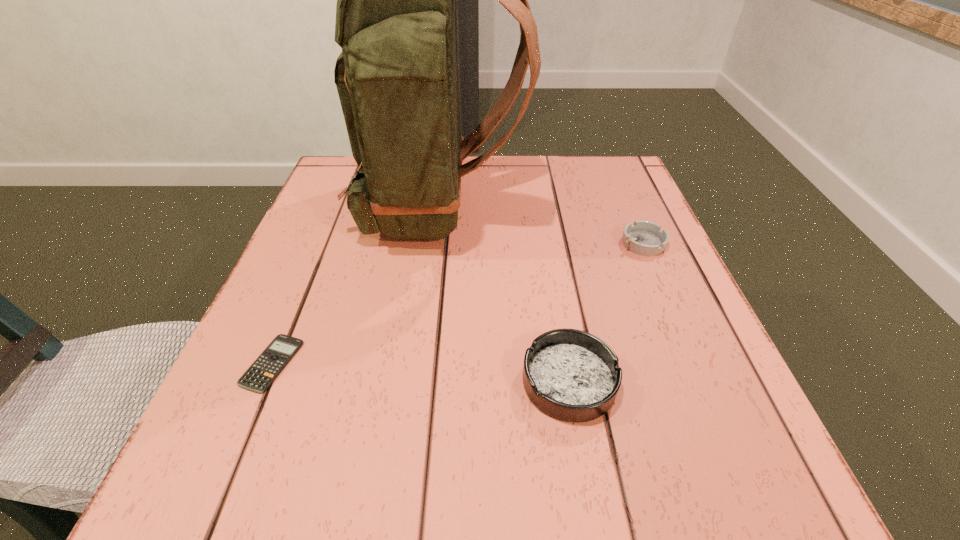
At what (x,y) coordinates should I click in order to perform the action: click on unoccupied area between the taller ashtray and the second shortest object. Please return your answer as a coordinate pair (x, y). Looking at the image, I should click on (606, 312).

What are the coordinates of `empty space that is in between the shortest object and the third shortest object` in the screenshot? It's located at (420, 372).

This screenshot has height=540, width=960. Find the location of `object that is the closest to the shortest object`. object that is the closest to the shortest object is located at coordinates (398, 76).

Where is `the second closest object relative to the shortest object`? The image size is (960, 540). the second closest object relative to the shortest object is located at coordinates (571, 375).

Locate an element on the screen. This screenshot has height=540, width=960. vacant space that satisfies the following two spatial constraints: 1. on the back side of the leftmost object; 2. on the left side of the rightmost object is located at coordinates (323, 243).

I want to click on vacant space that satisfies the following two spatial constraints: 1. on the back side of the second shortest object; 2. on the back of the backpack, so click(x=628, y=208).

The height and width of the screenshot is (540, 960). I want to click on vacant space that satisfies the following two spatial constraints: 1. on the back of the third shortest object; 2. on the right side of the backpack, so click(420, 381).

Find the location of a particular element. Image resolution: width=960 pixels, height=540 pixels. free location that satisfies the following two spatial constraints: 1. on the back of the backpack; 2. on the front side of the calculator is located at coordinates (421, 363).